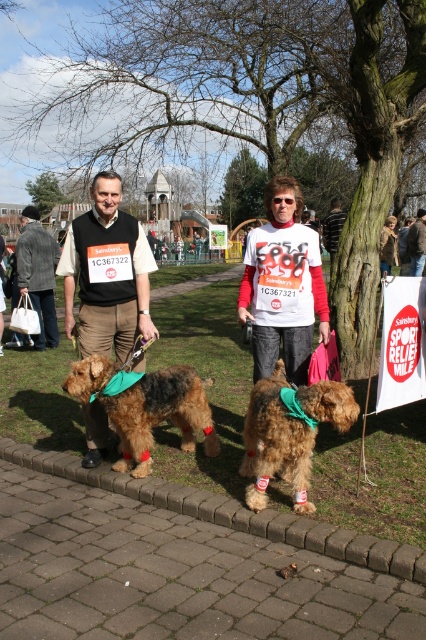
You are a photographer at the event and want to capture both the brown furry dog at center and the brown shaggy dog at center in the same frame. The minimum distance between the two dogs must be maintained for the photo. What is the minimum distance you need to ensure between them?

The minimum distance you need to ensure between the brown furry dog at center and the brown shaggy dog at center is 33.65 inches to maintain their positions as captured in the image.

You are a participant in the Sport Relief Mile event and need to place your water bottle on the ground near the paved brick pavement at lower center. Considering the brown leather jacket at center, where should you place the water bottle to ensure it doesn

The paved brick pavement at lower center is not as tall as the brown leather jacket at center, so placing the water bottle on the ground next to the paved brick pavement at lower center would be safer as it is lower than the jacket. This prevents the bottle from being knocked over by the jacket.